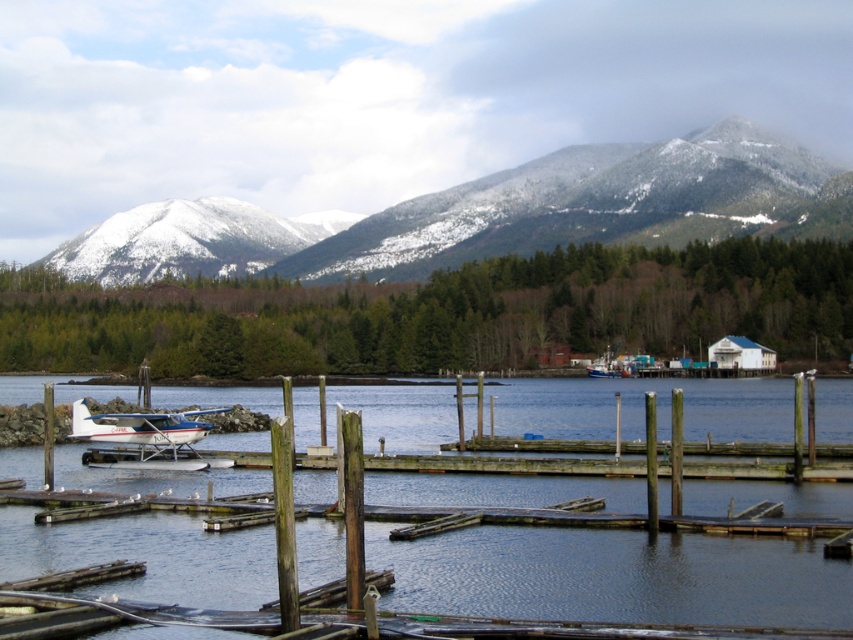
What do you see at coordinates (189, 241) in the screenshot? The height and width of the screenshot is (640, 853). I see `white snow-covered mountain at upper left` at bounding box center [189, 241].

At what (x,y) coordinates should I click in order to perform the action: click on white snow-covered mountain at upper left. Please return your answer as a coordinate pair (x, y). The height and width of the screenshot is (640, 853). Looking at the image, I should click on (189, 241).

Locate an element on the screen. white snow-covered mountain at upper center is located at coordinates pos(492,212).

Does white snow-covered mountain at upper center have a lesser width compared to white glossy seaplane at lower left?

No, white snow-covered mountain at upper center is not thinner than white glossy seaplane at lower left.

This screenshot has height=640, width=853. In order to click on white snow-covered mountain at upper center in this screenshot , I will do `click(492, 212)`.

Looking at this image, can you confirm if smooth blue water at center is positioned below white snow-covered mountain at upper left?

Yes, smooth blue water at center is below white snow-covered mountain at upper left.

Image resolution: width=853 pixels, height=640 pixels. Identify the location of smooth blue water at center. (614, 577).

This screenshot has height=640, width=853. What are the coordinates of `smooth blue water at center` in the screenshot? It's located at (614, 577).